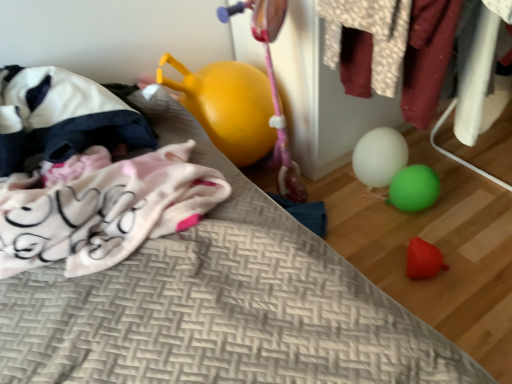
Question: Is white fabric bean bag at left wider than white matte balloon at center?

Choices:
 (A) no
 (B) yes

Answer: (B)

Question: Does white fabric bean bag at left have a larger size compared to white matte balloon at center?

Choices:
 (A) yes
 (B) no

Answer: (A)

Question: Is white fabric bean bag at left looking in the opposite direction of white matte balloon at center?

Choices:
 (A) no
 (B) yes

Answer: (A)

Question: Does white fabric bean bag at left have a lesser height compared to white matte balloon at center?

Choices:
 (A) no
 (B) yes

Answer: (A)

Question: Can you confirm if white fabric bean bag at left is taller than white matte balloon at center?

Choices:
 (A) no
 (B) yes

Answer: (B)

Question: Looking at their shapes, would you say patterned fabric shirt at upper right is wider or thinner than white matte balloon at center?

Choices:
 (A) thin
 (B) wide

Answer: (B)

Question: From a real-world perspective, is patterned fabric shirt at upper right above or below white matte balloon at center?

Choices:
 (A) above
 (B) below

Answer: (A)

Question: In terms of height, does patterned fabric shirt at upper right look taller or shorter compared to white matte balloon at center?

Choices:
 (A) short
 (B) tall

Answer: (B)

Question: In the image, is patterned fabric shirt at upper right on the left side or the right side of white matte balloon at center?

Choices:
 (A) left
 (B) right

Answer: (A)

Question: Based on their positions, is white matte balloon at center located to the left or right of white fabric bean bag at left?

Choices:
 (A) left
 (B) right

Answer: (B)

Question: Does point (398, 198) appear closer or farther from the camera than point (34, 96)?

Choices:
 (A) farther
 (B) closer

Answer: (A)

Question: Is white matte balloon at center bigger or smaller than white fabric bean bag at left?

Choices:
 (A) small
 (B) big

Answer: (A)

Question: In terms of width, does white matte balloon at center look wider or thinner when compared to white fabric bean bag at left?

Choices:
 (A) wide
 (B) thin

Answer: (B)

Question: Considering the positions of white fabric bean bag at left and white matte balloon at center in the image, is white fabric bean bag at left taller or shorter than white matte balloon at center?

Choices:
 (A) tall
 (B) short

Answer: (A)

Question: Do you think white fabric bean bag at left is within white matte balloon at center, or outside of it?

Choices:
 (A) inside
 (B) outside

Answer: (B)